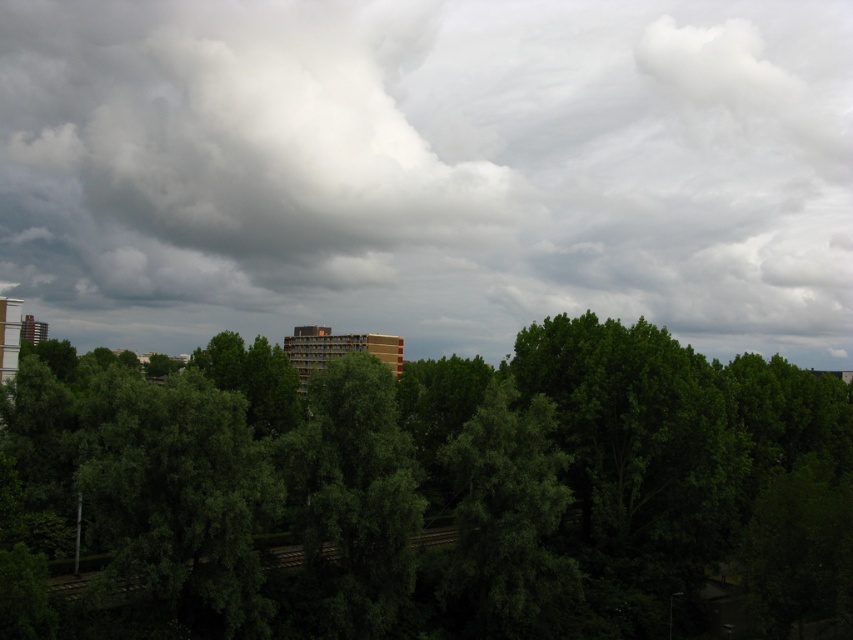
Can you confirm if white fluffy cloud at upper center is bigger than green leafy tree at center?

Yes.

Describe the element at coordinates (428, 170) in the screenshot. The height and width of the screenshot is (640, 853). I see `white fluffy cloud at upper center` at that location.

The height and width of the screenshot is (640, 853). Find the location of `white fluffy cloud at upper center`. white fluffy cloud at upper center is located at coordinates (428, 170).